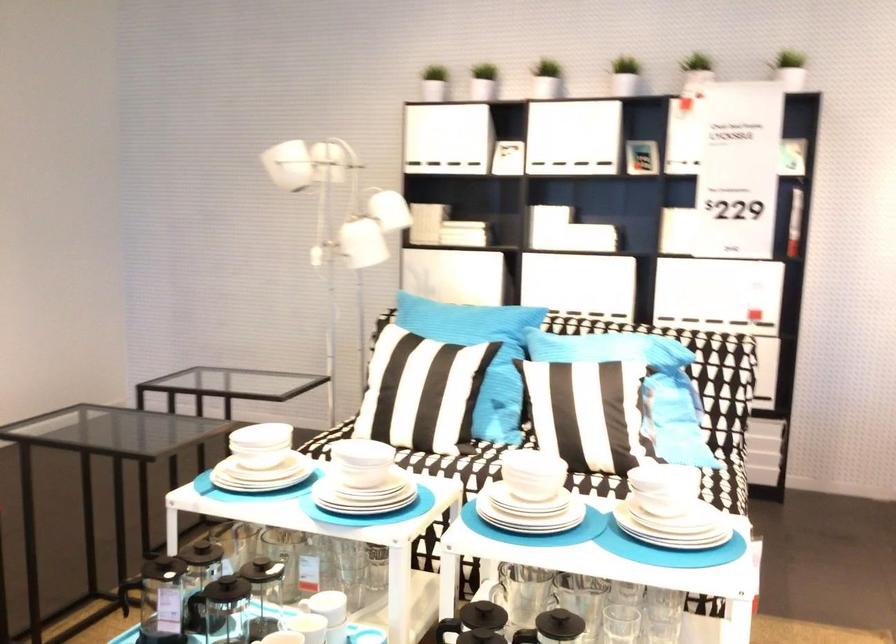
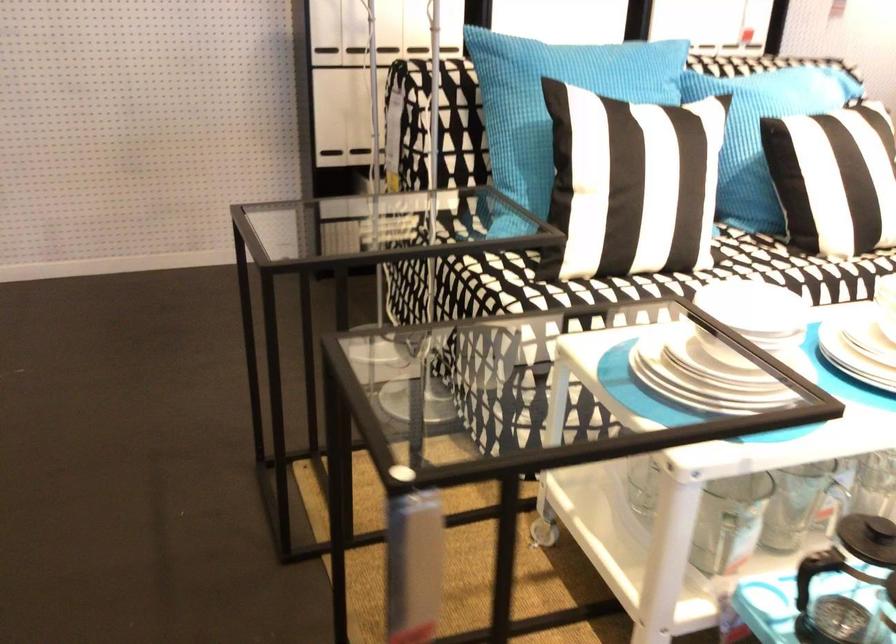
Locate, in the second image, the point that corresponds to (228,562) in the first image.

(867, 538)